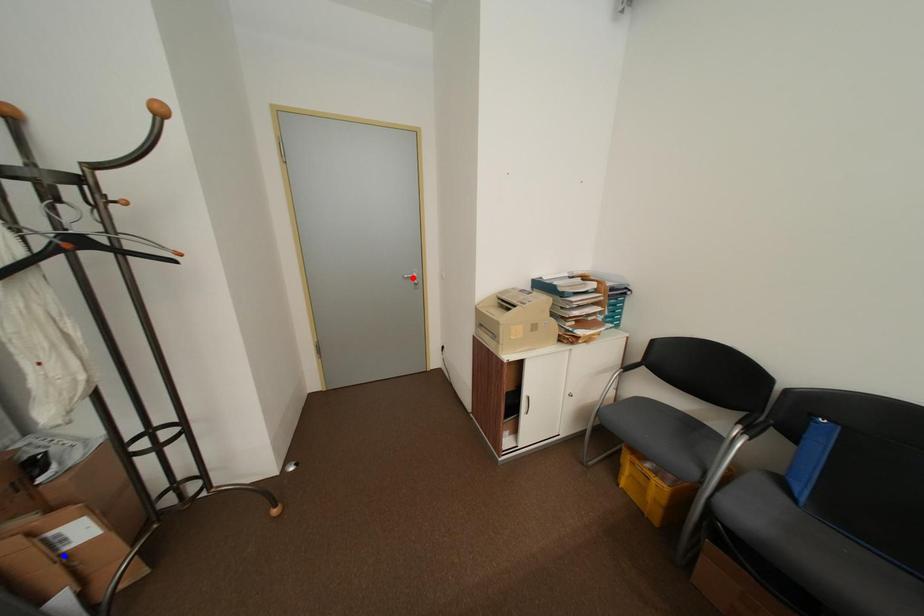
Question: Two points are marked on the image. Which point is closer to the camera?

Choices:
 (A) Blue point is closer.
 (B) Red point is closer.

Answer: (A)